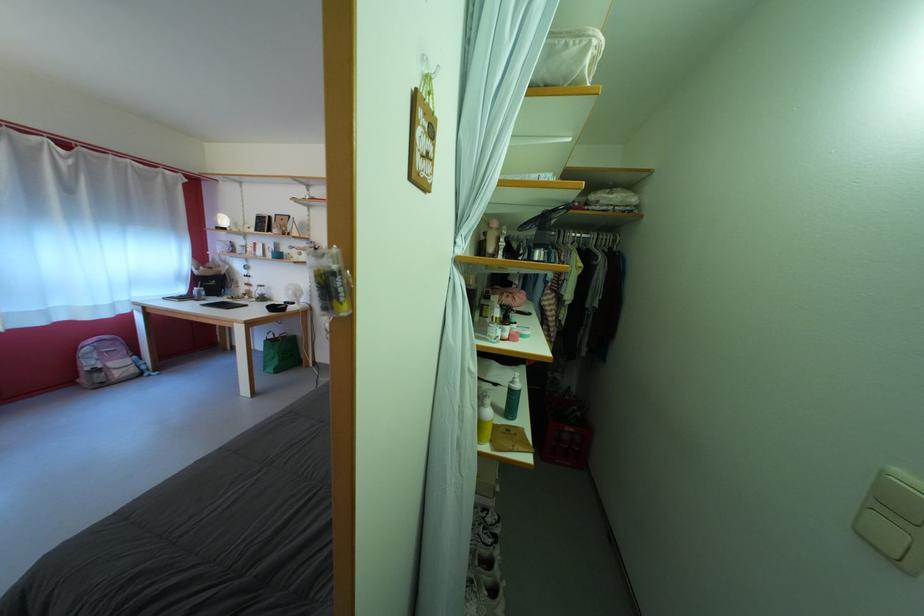
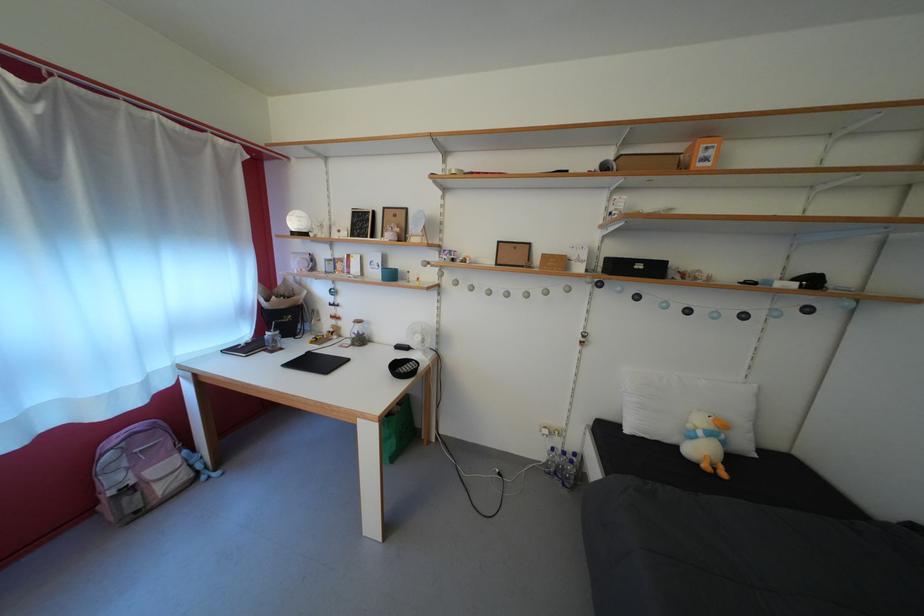
Where in the second image is the point corresponding to point 200,296 from the first image?

(268, 339)